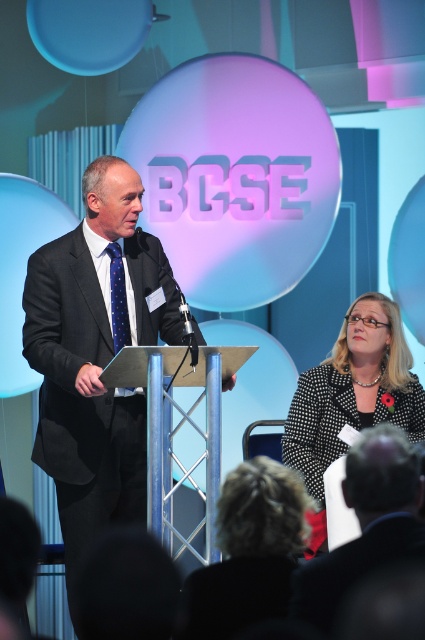
Between dark gray suit at center and blue dotted tie at left, which one has more height?

dark gray suit at center

Does dark gray suit at center have a smaller size compared to blue dotted tie at left?

No.

Where is `dark gray suit at center`? This screenshot has width=425, height=640. dark gray suit at center is located at coordinates (365, 524).

Which is more to the right, black suit at center or black textured blazer at center?

From the viewer's perspective, black textured blazer at center appears more on the right side.

This screenshot has width=425, height=640. Describe the element at coordinates (93, 358) in the screenshot. I see `black suit at center` at that location.

Locate an element on the screen. The image size is (425, 640). black suit at center is located at coordinates (93, 358).

Does point (294, 445) lie behind point (379, 557)?

That is True.

Who is positioned more to the right, black textured blazer at center or dark gray suit at center?

black textured blazer at center

You are a GUI agent. You are given a task and a screenshot of the screen. Output one action in this format:
    pyautogui.click(x=<x>, y=<y>)
    Task: Click on the black textured blazer at center
    
    Given the screenshot: What is the action you would take?
    pyautogui.click(x=354, y=390)

At what (x,y) coordinates should I click in order to perform the action: click on black textured blazer at center. Please return your answer as a coordinate pair (x, y). Looking at the image, I should click on (354, 390).